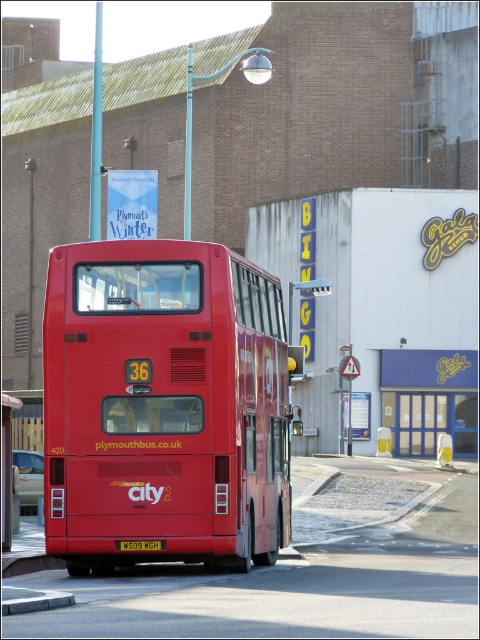
Is matte red bus at center closer to the viewer compared to yellow matte license plate at rear?

That is False.

Is point (268, 388) closer to viewer compared to point (164, 541)?

No, it is behind (164, 541).

Locate an element on the screen. This screenshot has height=640, width=480. matte red bus at center is located at coordinates click(x=164, y=404).

Is the position of matte red bus at center less distant than that of metallic silver pole at left?

Yes, it is.

Between matte red bus at center and metallic silver pole at left, which one has less height?

Standing shorter between the two is metallic silver pole at left.

Find the location of a particular element. matte red bus at center is located at coordinates coord(164,404).

This screenshot has height=640, width=480. I want to click on matte red bus at center, so tap(164, 404).

Who is higher up, metallic silver pole at left or yellow matte license plate at rear?

yellow matte license plate at rear

Is point (6, 540) more distant than point (133, 548)?

That is True.

Locate an element on the screen. The width and height of the screenshot is (480, 640). metallic silver pole at left is located at coordinates (7, 467).